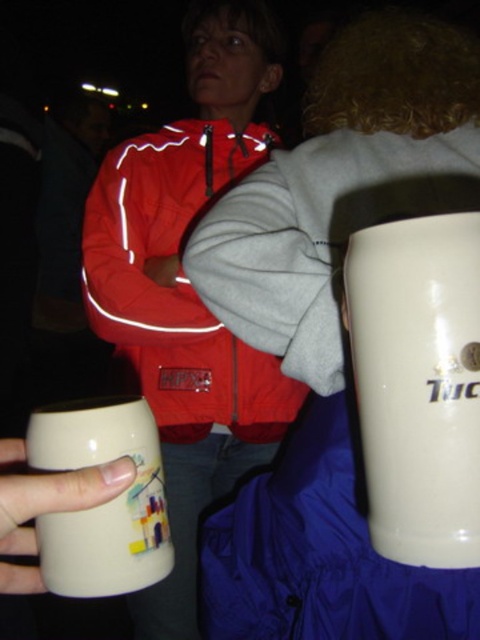
You are a photographer trying to capture a closeup of the white glossy mug at right without the matte ceramic mug at lower left blocking the view. Is this possible given their positions?

The white glossy mug at right is closer to the viewer than the matte ceramic mug at lower left, so you can take a closeup of the white glossy mug at right without the matte ceramic mug at lower left blocking the view since it is further away.